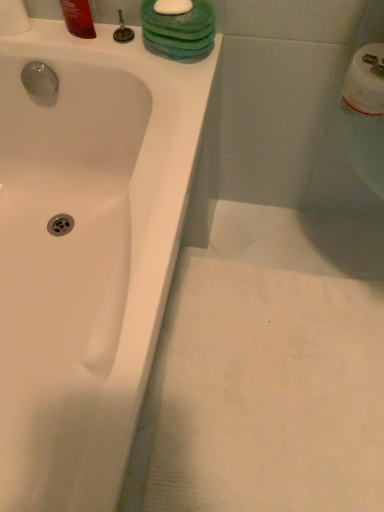
Where is `vacant space in front of matte silver faucet at upper center`? This screenshot has width=384, height=512. vacant space in front of matte silver faucet at upper center is located at coordinates (156, 82).